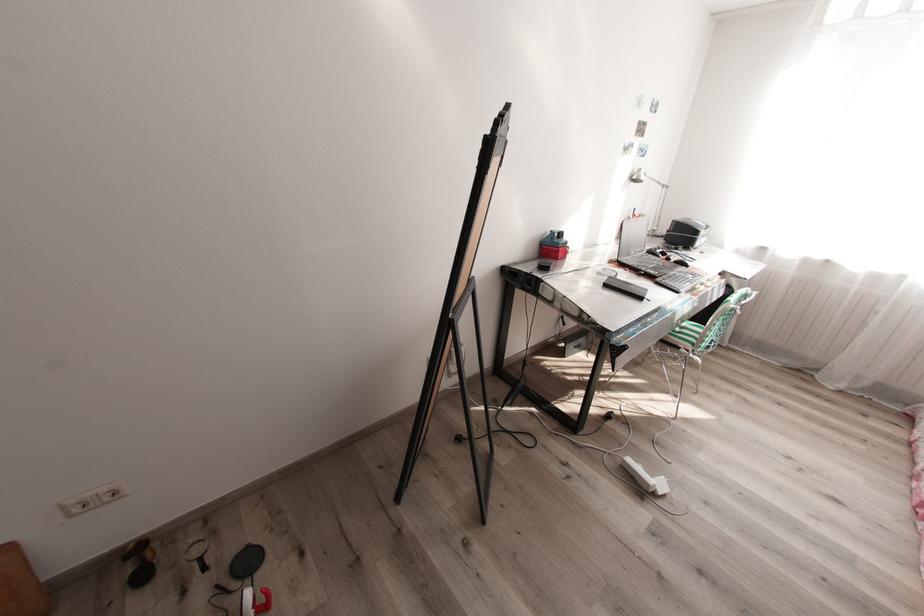
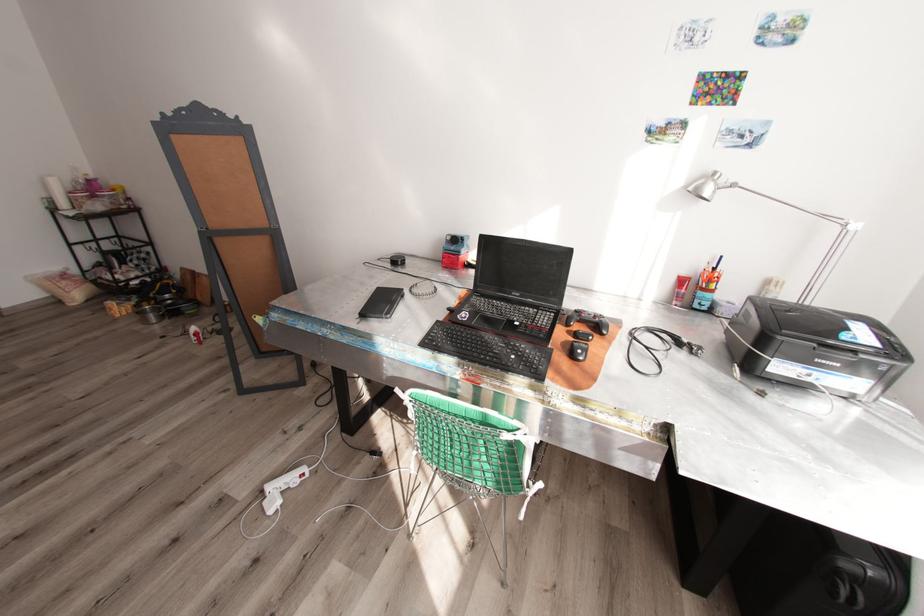
Locate, in the second image, the point that corresponds to (x=638, y=177) in the first image.

(695, 188)